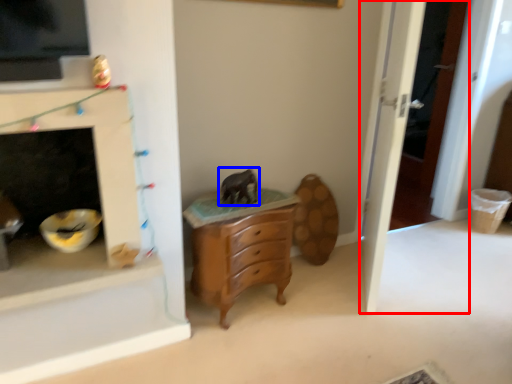
Question: Among these objects, which one is nearest to the camera, door (highlighted by a red box) or animal (highlighted by a blue box)?

Choices:
 (A) door
 (B) animal

Answer: (A)